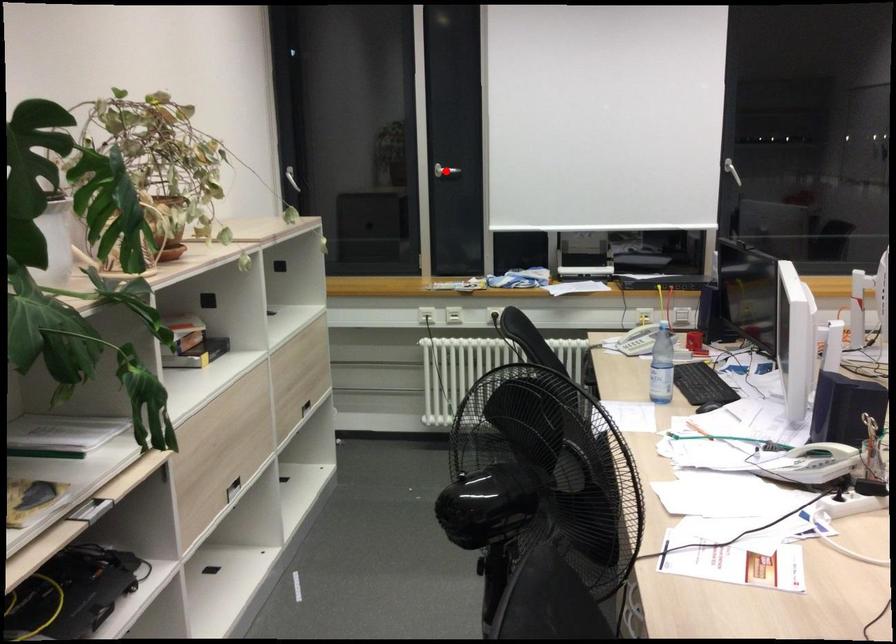
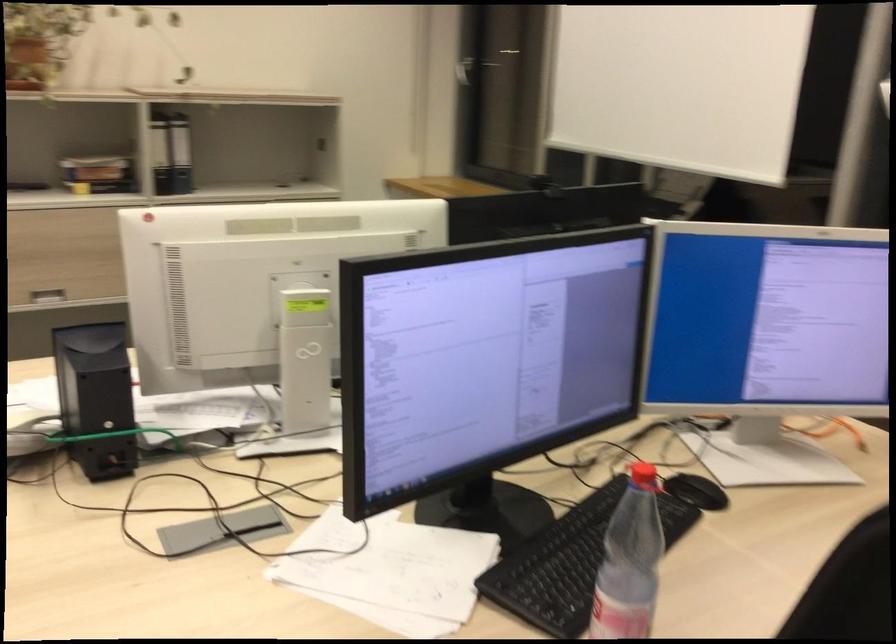
Question: I am providing you with two images of the same scene from different viewpoints. A red point is marked on the first image. Is the red point's position out of view in image 2?

Choices:
 (A) Yes
 (B) No

Answer: (A)